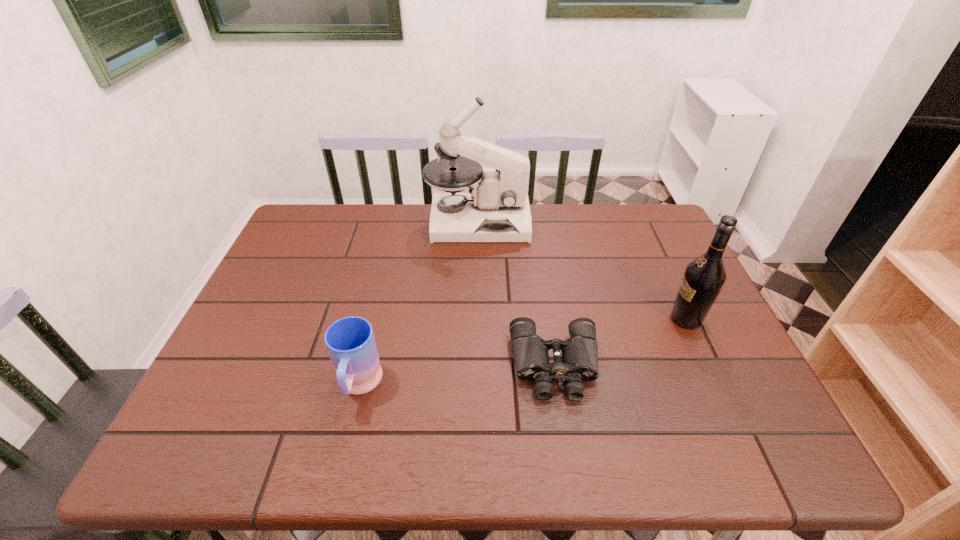
Where is `free space at the near left corner`? This screenshot has height=540, width=960. free space at the near left corner is located at coordinates (243, 422).

This screenshot has width=960, height=540. In order to click on vacant area that lies between the leftmost object and the microscope in this screenshot , I will do (419, 304).

At what (x,y) coordinates should I click in order to perform the action: click on empty space between the rightmost object and the shortest object. Please return your answer as a coordinate pair (x, y). This screenshot has width=960, height=540. Looking at the image, I should click on (620, 342).

Where is `vacant area that lies between the second farthest object and the tallest object`? The width and height of the screenshot is (960, 540). vacant area that lies between the second farthest object and the tallest object is located at coordinates (582, 271).

Where is `free point between the mug and the microscope`? This screenshot has height=540, width=960. free point between the mug and the microscope is located at coordinates click(x=419, y=304).

This screenshot has height=540, width=960. In order to click on free space between the microscope and the shortest object in this screenshot , I will do `click(516, 294)`.

Where is `unoccupied position between the binoculars and the tallest object`? This screenshot has height=540, width=960. unoccupied position between the binoculars and the tallest object is located at coordinates (516, 294).

I want to click on free space that is in between the shortest object and the farthest object, so click(x=516, y=294).

Locate an element on the screen. The width and height of the screenshot is (960, 540). free space between the binoculars and the leftmost object is located at coordinates (457, 376).

Find the location of `blank region between the third tallest object and the shortest object`. blank region between the third tallest object and the shortest object is located at coordinates (457, 376).